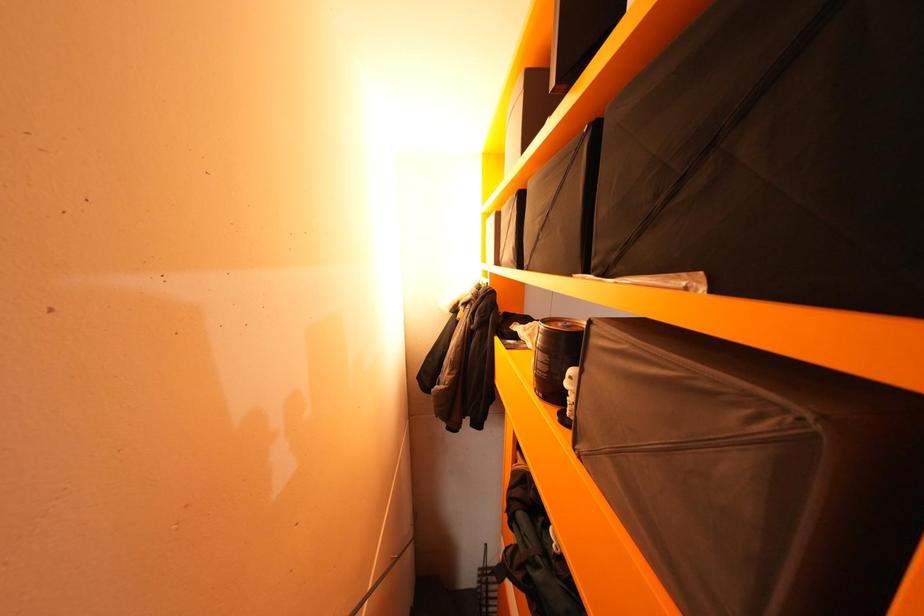
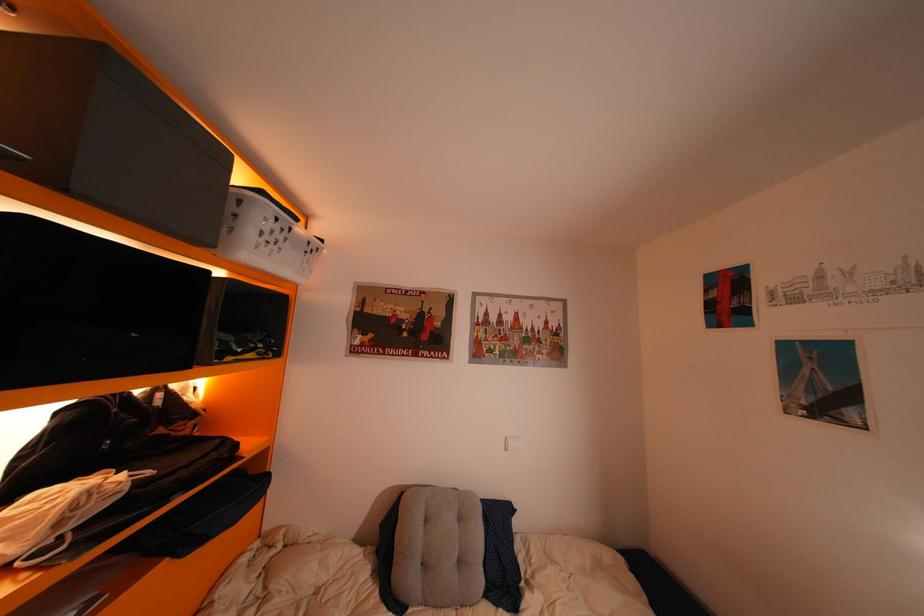
In a continuous first-person perspective shot, in which direction is the camera moving?

The movement direction of the cameraman is right, forward.